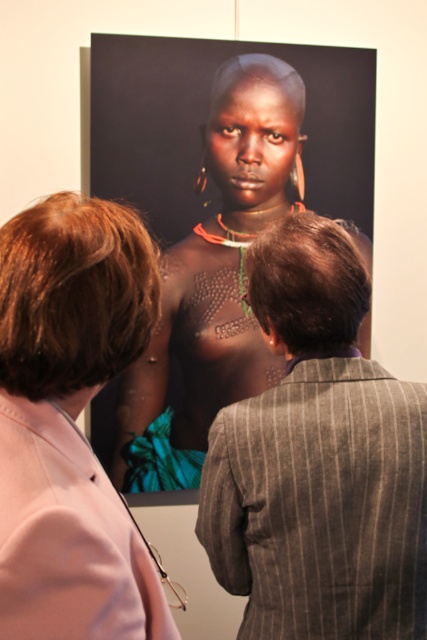
You are an interior designer assessing the art gallery layout. You notice the pink fabric at upper left and the matte black skin at center. Which object takes up more space in the image?

The matte black skin at center takes up more space in the image because it is larger than the pink fabric at upper left.

You are standing in the art gallery and want to take a photo of the gray pinstripe suit at center without getting too close. If your camera has a maximum focus range of 35 inches, can you capture a clear image from your current position?

The gray pinstripe suit at center is 38.21 inches from viewer, which exceeds the camera maximum focus range of 35 inches. Therefore, you cannot capture a clear image from your current position.

You are an event planner organizing a photoshoot in this art gallery. You need to place a large equipment box that requires 2 meters of space. You see the gray pinstripe suit at center and the pink fabric at upper left. Which object can accommodate the equipment box based on their sizes?

The gray pinstripe suit at center has a larger size compared to the pink fabric at upper left, so the equipment box can be placed near the gray pinstripe suit at center as it provides enough space.